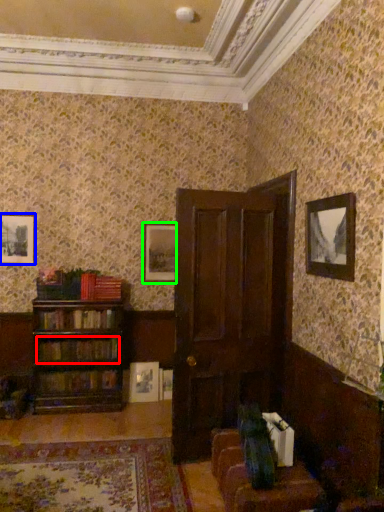
Question: Considering the real-world distances, which object is farthest from book (highlighted by a red box)? picture frame (highlighted by a blue box) or picture frame (highlighted by a green box)?

Choices:
 (A) picture frame
 (B) picture frame

Answer: (A)